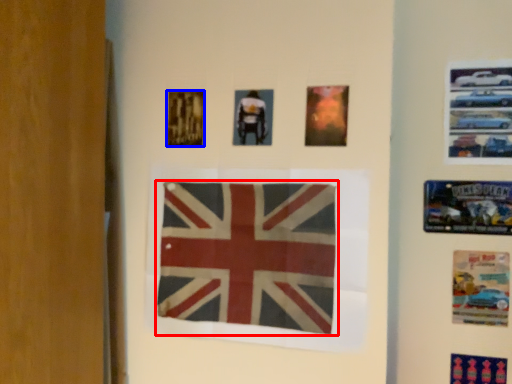
Question: Which object appears farthest to the camera in this image, flag (highlighted by a red box) or poster (highlighted by a blue box)?

Choices:
 (A) flag
 (B) poster

Answer: (B)